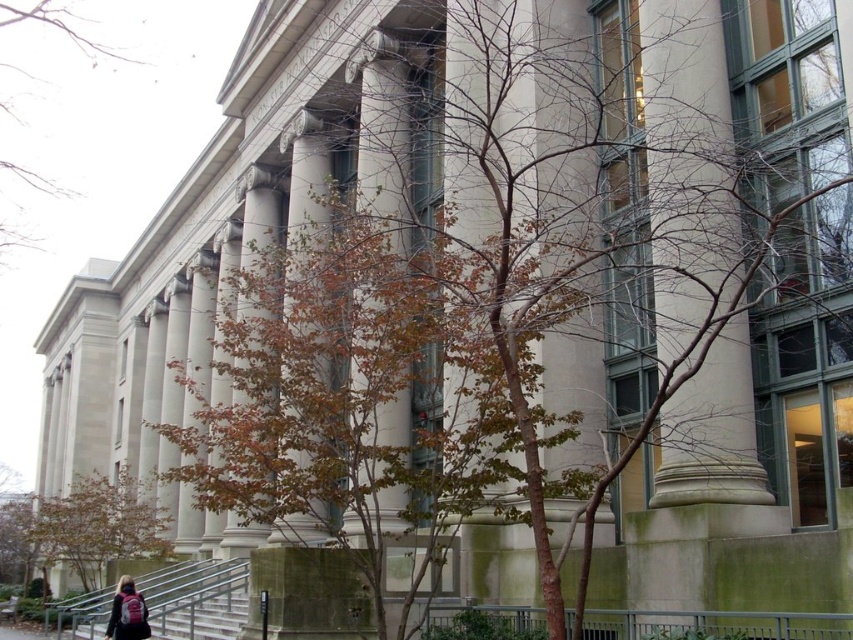
Can you confirm if brown leafy tree at lower left is positioned below brown leafy tree at upper left?

Yes, brown leafy tree at lower left is below brown leafy tree at upper left.

Can you confirm if brown leafy tree at lower left is shorter than brown leafy tree at upper left?

Yes.

Image resolution: width=853 pixels, height=640 pixels. Identify the location of brown leafy tree at lower left. click(83, 528).

Identify the location of brown leafy tree at lower left. This screenshot has height=640, width=853. click(x=83, y=528).

Who is positioned more to the right, brown leafy tree at upper left or pink fabric backpack at lower left?

pink fabric backpack at lower left is more to the right.

Does brown leafy tree at upper left have a greater height compared to pink fabric backpack at lower left?

Correct, brown leafy tree at upper left is much taller as pink fabric backpack at lower left.

Is point (68, 16) positioned in front of point (111, 620)?

No, it is not.

Locate an element on the screen. This screenshot has width=853, height=640. brown leafy tree at upper left is located at coordinates (33, 92).

From the picture: Which is more to the left, brown leafy tree at upper left or gray concrete stairs at lower left?

From the viewer's perspective, brown leafy tree at upper left appears more on the left side.

The width and height of the screenshot is (853, 640). What are the coordinates of `brown leafy tree at upper left` in the screenshot? It's located at (33, 92).